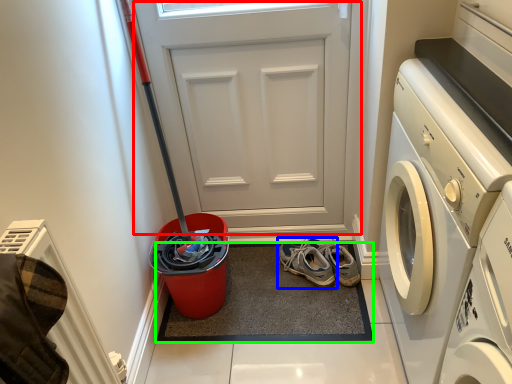
Question: Which is nearer to the door (highlighted by a red box)? footwear (highlighted by a blue box) or doormat (highlighted by a green box).

Choices:
 (A) footwear
 (B) doormat

Answer: (A)